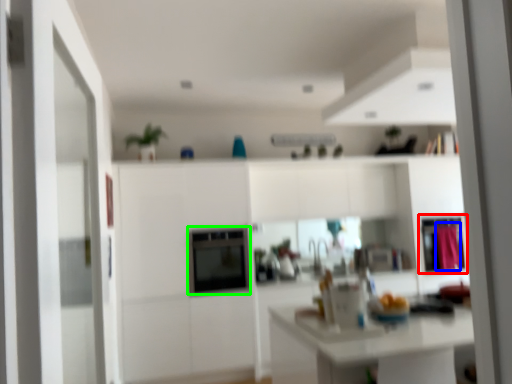
Question: Estimate the real-world distances between objects in this image. Which object is closer to cabinetry (highlighted by a red box), curtain (highlighted by a blue box) or appliance (highlighted by a green box)?

Choices:
 (A) curtain
 (B) appliance

Answer: (A)